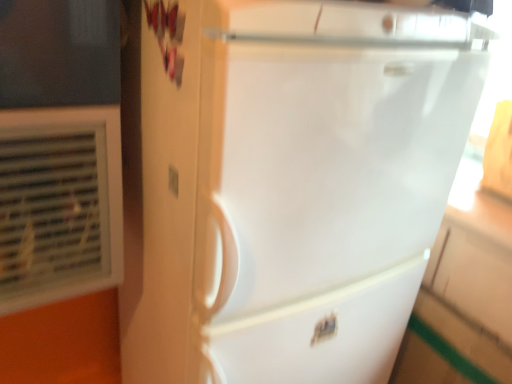
Question: Would you say matte white outlet at center is part of white glossy refrigerator at center's contents?

Choices:
 (A) no
 (B) yes

Answer: (B)

Question: Can you confirm if white glossy refrigerator at center is positioned to the right of matte white outlet at center?

Choices:
 (A) yes
 (B) no

Answer: (A)

Question: From the image's perspective, is white glossy refrigerator at center above matte white outlet at center?

Choices:
 (A) yes
 (B) no

Answer: (B)

Question: Can you confirm if white glossy refrigerator at center is bigger than matte white outlet at center?

Choices:
 (A) yes
 (B) no

Answer: (A)

Question: Are white glossy refrigerator at center and matte white outlet at center far apart?

Choices:
 (A) no
 (B) yes

Answer: (A)

Question: Does white glossy refrigerator at center have a smaller size compared to matte white outlet at center?

Choices:
 (A) yes
 (B) no

Answer: (B)

Question: Does matte white outlet at center have a larger size compared to white glossy refrigerator at center?

Choices:
 (A) no
 (B) yes

Answer: (A)

Question: Is matte white outlet at center to the left of white glossy refrigerator at center from the viewer's perspective?

Choices:
 (A) yes
 (B) no

Answer: (A)

Question: Does matte white outlet at center contain white glossy refrigerator at center?

Choices:
 (A) yes
 (B) no

Answer: (B)

Question: From the image's perspective, is matte white outlet at center beneath white glossy refrigerator at center?

Choices:
 (A) yes
 (B) no

Answer: (B)

Question: Would you say matte white outlet at center is outside white glossy refrigerator at center?

Choices:
 (A) yes
 (B) no

Answer: (B)

Question: Is matte white outlet at center positioned far away from white glossy refrigerator at center?

Choices:
 (A) yes
 (B) no

Answer: (B)

Question: Is white plastic air conditioning unit at left looking in the opposite direction of matte white outlet at center?

Choices:
 (A) yes
 (B) no

Answer: (B)